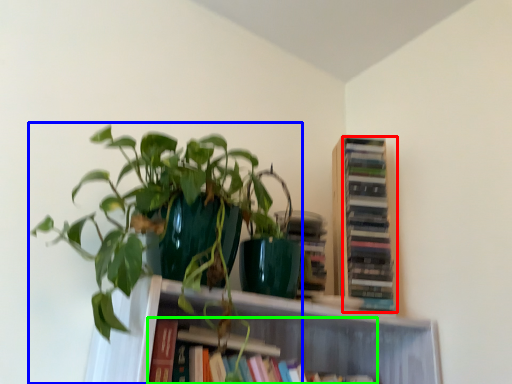
Question: Estimate the real-world distances between objects in this image. Which object is farther from book (highlighted by a red box), houseplant (highlighted by a blue box) or book (highlighted by a green box)?

Choices:
 (A) houseplant
 (B) book

Answer: (A)